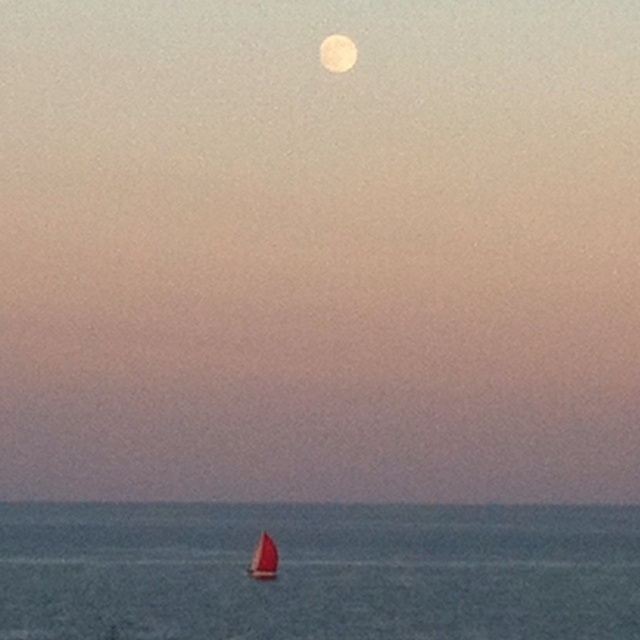
Question: Considering the real-world distances, which object is farthest from the blue water at center?

Choices:
 (A) smooth white moon at upper center
 (B) red sailboat at lower center

Answer: (A)

Question: Can you confirm if blue water at center is bigger than red sailboat at lower center?

Choices:
 (A) no
 (B) yes

Answer: (B)

Question: Can you confirm if blue water at center is wider than smooth white moon at upper center?

Choices:
 (A) no
 (B) yes

Answer: (B)

Question: Considering the real-world distances, which object is closest to the blue water at center?

Choices:
 (A) red sailboat at lower center
 (B) smooth white moon at upper center

Answer: (A)

Question: Where is smooth white moon at upper center located in relation to red sailboat at lower center in the image?

Choices:
 (A) right
 (B) left

Answer: (A)

Question: Which object is positioned farthest from the blue water at center?

Choices:
 (A) smooth white moon at upper center
 (B) red sailboat at lower center

Answer: (A)